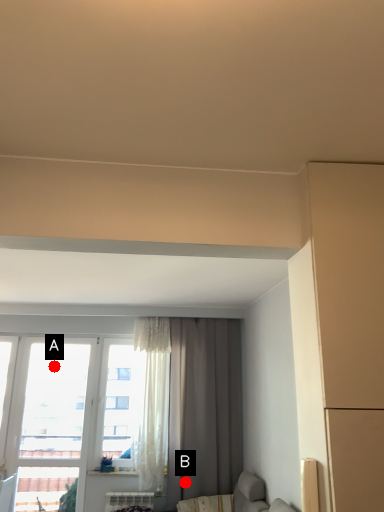
Question: Two points are circled on the image, labeled by A and B beside each circle. Which point appears closest to the camera in this image?

Choices:
 (A) A is closer
 (B) B is closer

Answer: (B)